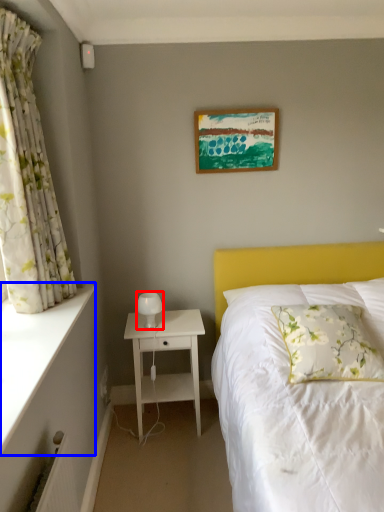
Question: Which of the following is the closest to the observer, table lamp (highlighted by a red box) or ledge (highlighted by a blue box)?

Choices:
 (A) table lamp
 (B) ledge

Answer: (B)